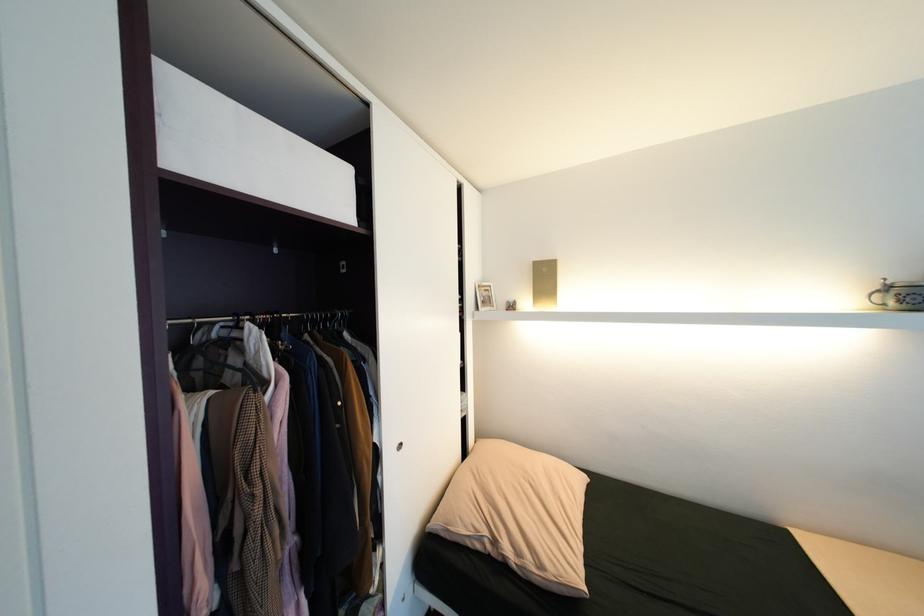
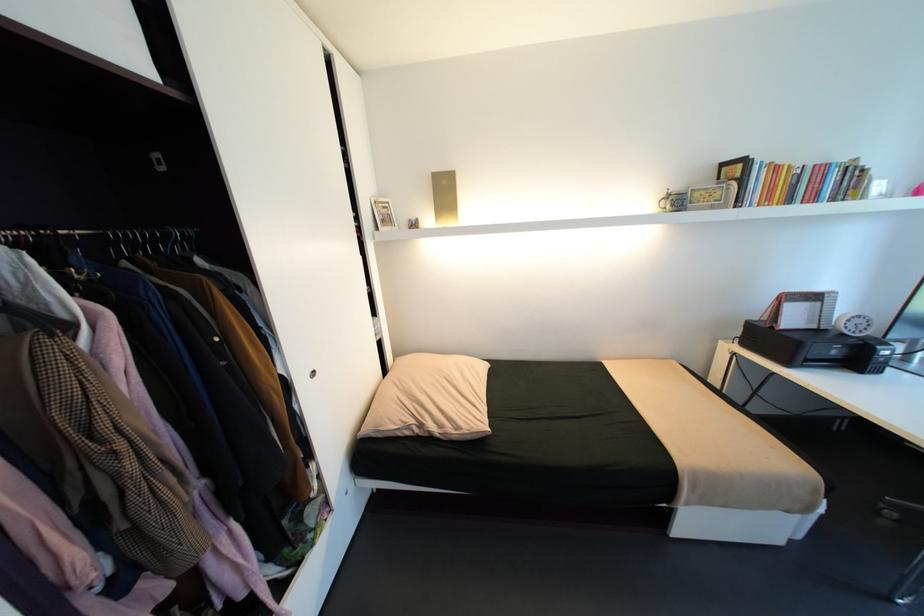
In the second image, find the point that corresponds to (493,291) in the first image.

(392, 208)